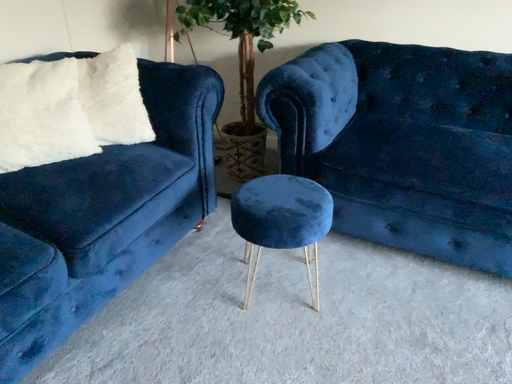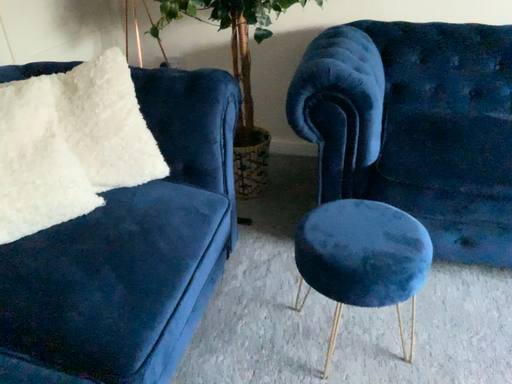
Question: Which way did the camera rotate in the video?

Choices:
 (A) rotated left
 (B) rotated right

Answer: (B)